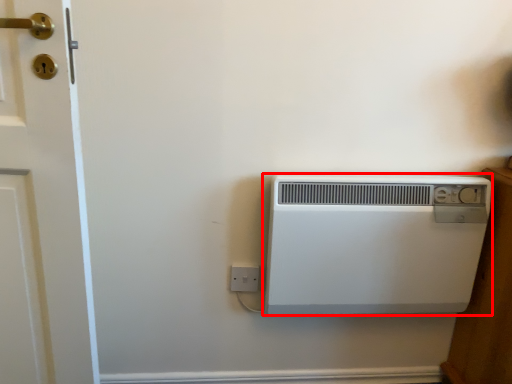
Question: Observing the image, what is the correct spatial positioning of home appliance (annotated by the red box) in reference to electric outlet?

Choices:
 (A) right
 (B) left

Answer: (A)